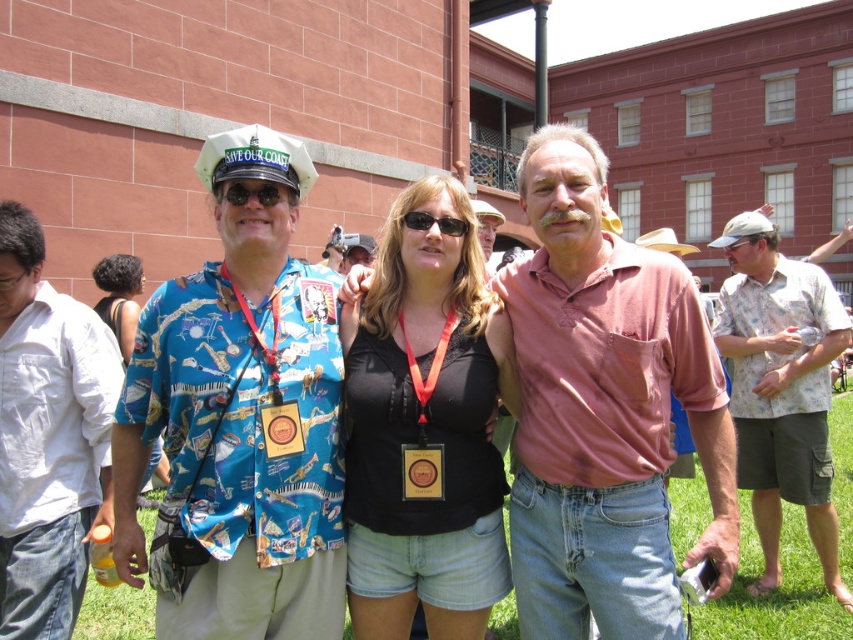
Between white cotton shirt at left and floral cotton shirt at right, which one is positioned higher?

white cotton shirt at left

Does white cotton shirt at left have a greater height compared to floral cotton shirt at right?

No, white cotton shirt at left is not taller than floral cotton shirt at right.

You are a GUI agent. You are given a task and a screenshot of the screen. Output one action in this format:
    pyautogui.click(x=<x>, y=<y>)
    Task: Click on the white cotton shirt at left
    
    Given the screenshot: What is the action you would take?
    pyautogui.click(x=48, y=436)

Is point (538, 534) positioned after point (100, 449)?

No, it is in front of (100, 449).

In the scene shown: Does pink cotton shirt at center appear on the left side of white cotton shirt at left?

In fact, pink cotton shirt at center is to the right of white cotton shirt at left.

Between point (543, 330) and point (94, 342), which one is positioned in front?

Point (543, 330) is in front.

The image size is (853, 640). In order to click on pink cotton shirt at center in this screenshot , I will do `click(604, 412)`.

Between white cotton shirt at left and green grass at center, which one appears on the right side from the viewer's perspective?

Positioned to the right is green grass at center.

Is point (13, 582) closer to viewer compared to point (790, 557)?

Yes, point (13, 582) is closer to viewer.

Between point (44, 612) and point (734, 616), which one is positioned behind?

Point (734, 616)

You are a GUI agent. You are given a task and a screenshot of the screen. Output one action in this format:
    pyautogui.click(x=<x>, y=<y>)
    Task: Click on the white cotton shirt at left
    
    Given the screenshot: What is the action you would take?
    pyautogui.click(x=48, y=436)